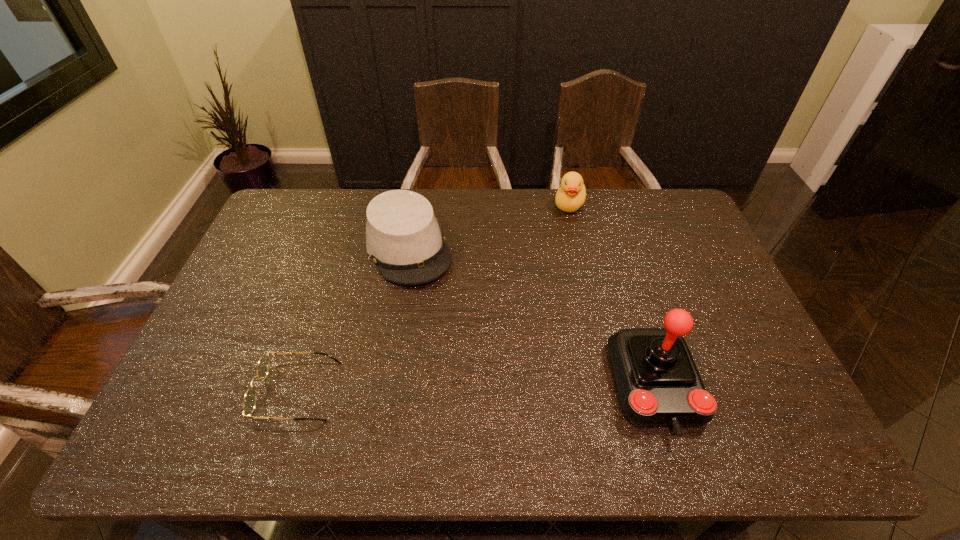
Find the location of a particular element. vacant region at the far left corner of the desktop is located at coordinates (294, 220).

Where is `free spot at the near left corner of the desktop`? free spot at the near left corner of the desktop is located at coordinates pos(235,403).

The height and width of the screenshot is (540, 960). In the image, there is a desktop. Identify the location of vacant space at the far right corner. (646, 204).

At what (x,y) coordinates should I click in order to perform the action: click on vacant area between the duck and the hat. Please return your answer as a coordinate pair (x, y). The image size is (960, 540). Looking at the image, I should click on (489, 227).

Identify the location of vacant area between the duck and the hat. (489, 227).

Locate an element on the screen. This screenshot has height=540, width=960. vacant area between the duck and the tallest object is located at coordinates (612, 296).

Where is `vacant space that is in between the hat and the tallest object`? vacant space that is in between the hat and the tallest object is located at coordinates click(x=532, y=318).

Identify the location of free spot between the spectacles and the hat. (353, 320).

This screenshot has width=960, height=540. I want to click on empty space that is in between the shortest object and the hat, so click(x=353, y=320).

Where is `vacant area that lies between the duck and the hat`? vacant area that lies between the duck and the hat is located at coordinates (489, 227).